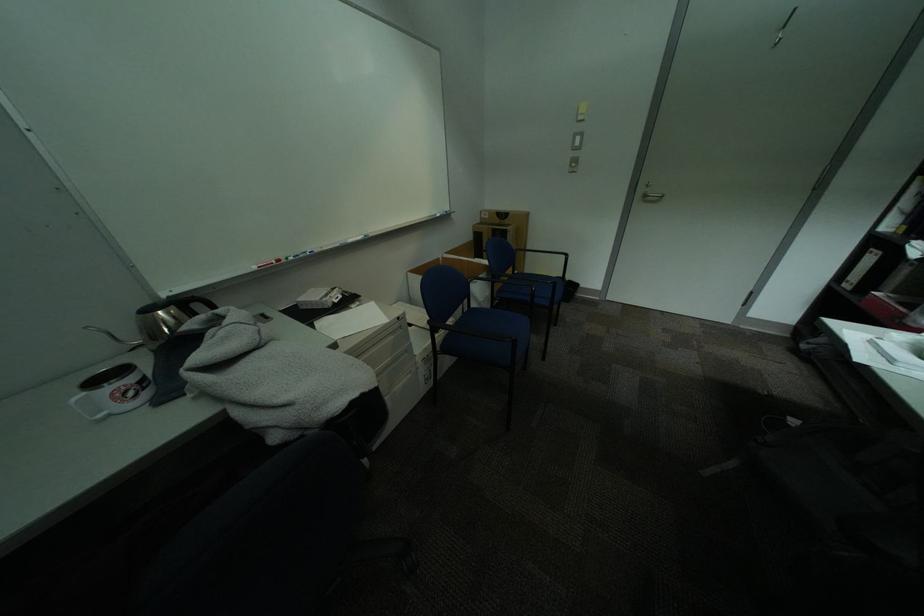
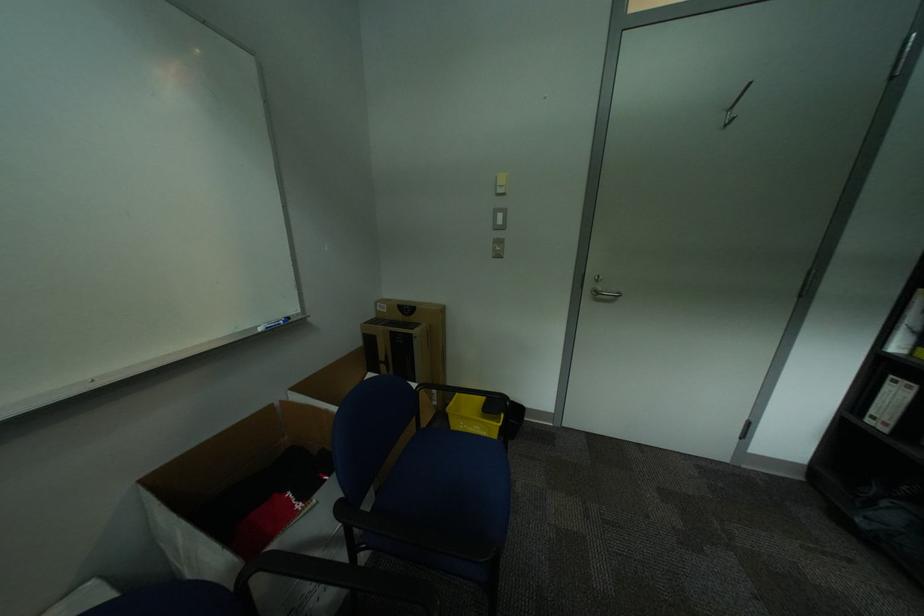
Find the pixel in the second image that matches (446,216) in the first image.

(266, 329)